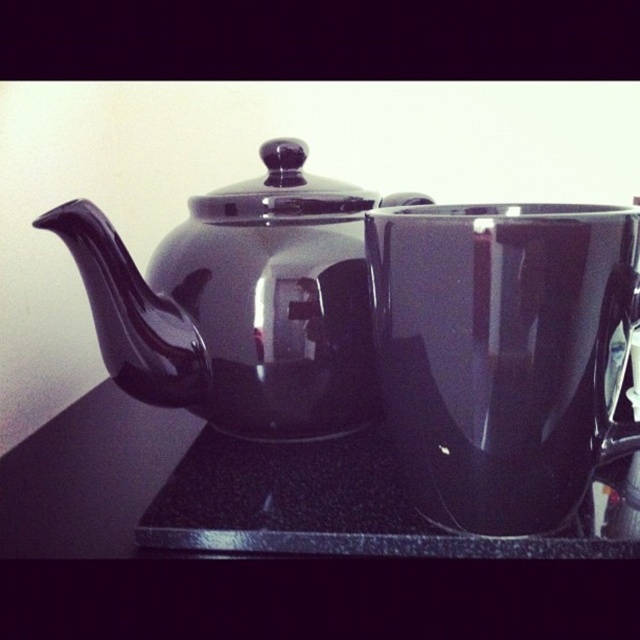
Question: Can you confirm if glossy ceramic mug at upper center is positioned to the left of glossy ceramic teapot at center?

Choices:
 (A) yes
 (B) no

Answer: (B)

Question: Is the position of glossy ceramic mug at upper center more distant than that of glossy ceramic teapot at center?

Choices:
 (A) yes
 (B) no

Answer: (B)

Question: Does glossy ceramic teapot at center have a larger size compared to glossy black countertop at center?

Choices:
 (A) yes
 (B) no

Answer: (A)

Question: Estimate the real-world distances between objects in this image. Which object is farther from the glossy ceramic teapot at center?

Choices:
 (A) glossy ceramic mug at upper center
 (B) glossy black countertop at center

Answer: (A)

Question: Which object is the closest to the glossy ceramic teapot at center?

Choices:
 (A) glossy black countertop at center
 (B) glossy ceramic mug at upper center

Answer: (A)

Question: Among these points, which one is nearest to the camera?

Choices:
 (A) (74, 224)
 (B) (595, 438)
 (C) (460, 552)

Answer: (B)